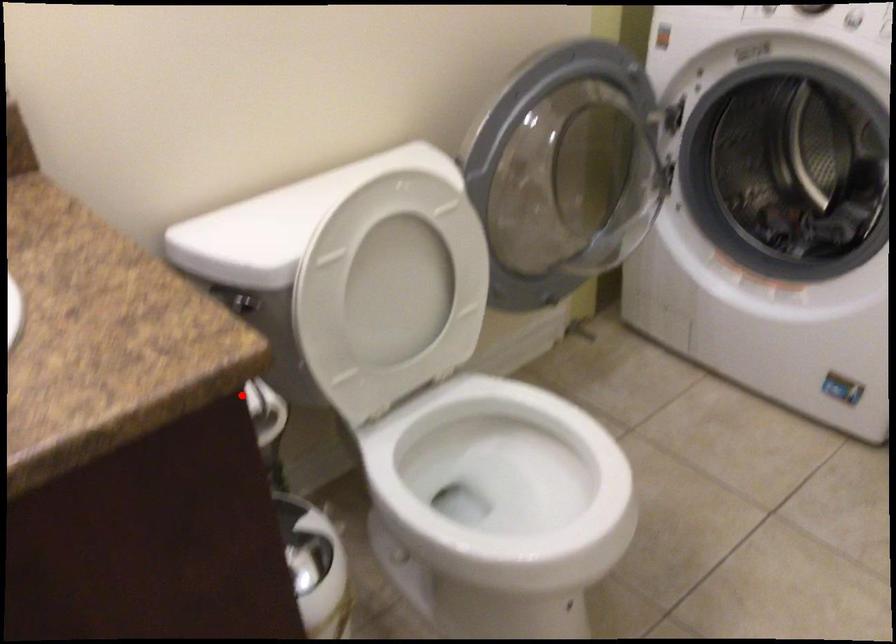
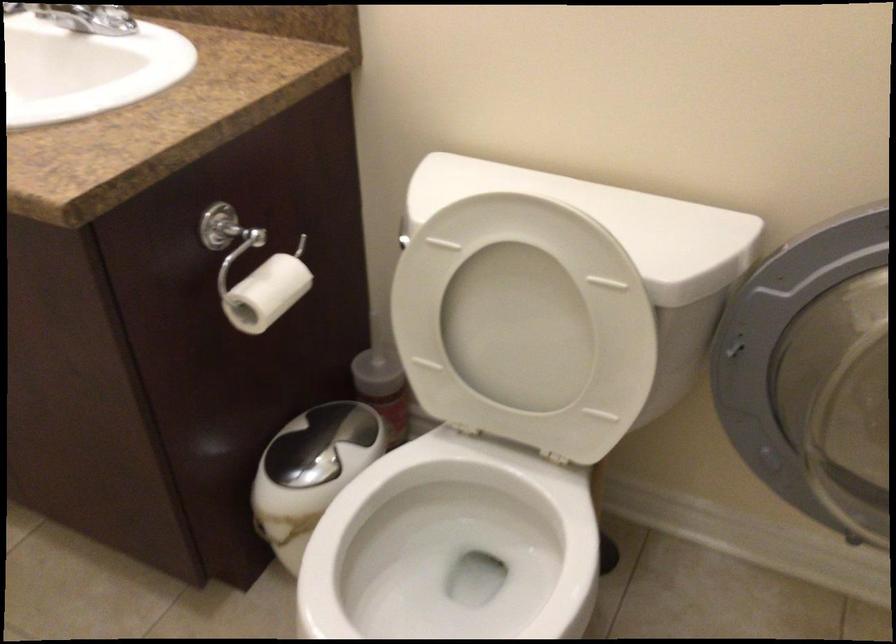
Question: I am providing you with two images of the same scene from different viewpoints. Image1 has a red point marked. In image2, the corresponding 3D location appears at what relative position? Reply with the corresponding letter.

Choices:
 (A) Closer
 (B) Farther

Answer: (B)